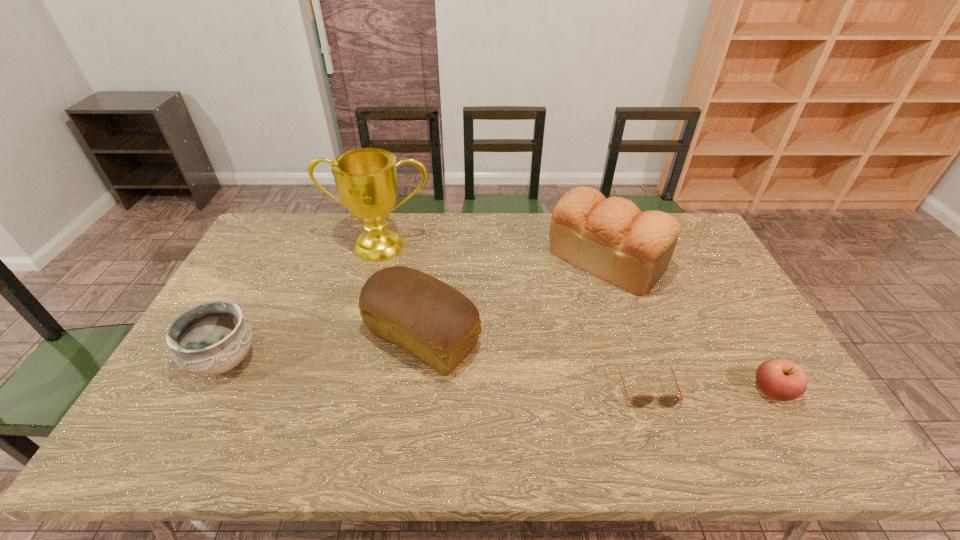
At what (x,y) coordinates should I click in order to perform the action: click on the tallest object. Please return your answer as a coordinate pair (x, y). Looking at the image, I should click on (366, 180).

Where is `the taller bread`? The image size is (960, 540). the taller bread is located at coordinates (611, 238).

Where is `the right bread`? Image resolution: width=960 pixels, height=540 pixels. the right bread is located at coordinates (611, 238).

Where is `the nearer bread`? Image resolution: width=960 pixels, height=540 pixels. the nearer bread is located at coordinates pyautogui.click(x=434, y=322).

Locate an element on the screen. The width and height of the screenshot is (960, 540). the third tallest object is located at coordinates (434, 322).

I want to click on the leftmost object, so click(x=212, y=338).

You are a GUI agent. You are given a task and a screenshot of the screen. Output one action in this format:
    pyautogui.click(x=<x>, y=<y>)
    Task: Click on the fourth tallest object
    This screenshot has height=540, width=960.
    Given the screenshot: What is the action you would take?
    pyautogui.click(x=212, y=338)

Locate an element on the screen. The width and height of the screenshot is (960, 540). apple is located at coordinates (782, 380).

The height and width of the screenshot is (540, 960). I want to click on the second shortest object, so click(x=782, y=380).

Where is `the shortest object`? the shortest object is located at coordinates (640, 400).